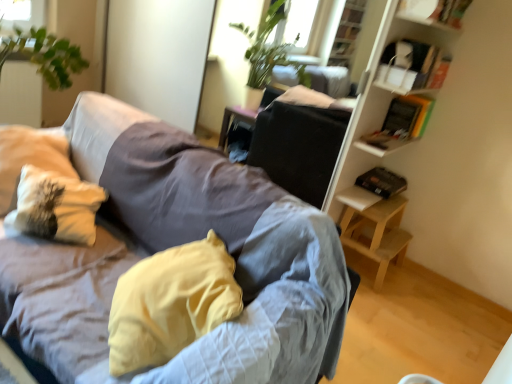
I want to click on wooden bookshelf at right, so click(x=376, y=112).

How much space does white textured pillow at left, marked as the second pillow in a right-to-left arrangement, occupy horizontally?

The width of white textured pillow at left, marked as the second pillow in a right-to-left arrangement, is 10.49 inches.

What do you see at coordinates (170, 303) in the screenshot? I see `yellow fabric pillow at center, which is counted as the first pillow, starting from the right` at bounding box center [170, 303].

The height and width of the screenshot is (384, 512). Describe the element at coordinates (374, 227) in the screenshot. I see `light wood table at lower right` at that location.

What do you see at coordinates (434, 12) in the screenshot?
I see `wooden bookshelf at upper right, which is the first shelf from top to bottom` at bounding box center [434, 12].

This screenshot has width=512, height=384. Describe the element at coordinates (224, 241) in the screenshot. I see `textured gray couch at center` at that location.

Locate an element on the screen. wooden bookshelf at right is located at coordinates (376, 112).

In the image, is light wood table at lower right on the left side or the right side of yellow fabric pillow at center, which is counted as the first pillow, starting from the right?

From the image, it's evident that light wood table at lower right is to the right of yellow fabric pillow at center, which is counted as the first pillow, starting from the right.

Does light wood table at lower right have a larger size compared to yellow fabric pillow at center, which is counted as the first pillow, starting from the right?

No.

Where is `table behind the yellow fabric pillow at center, the 2th pillow when ordered from left to right`? table behind the yellow fabric pillow at center, the 2th pillow when ordered from left to right is located at coordinates (374, 227).

Is light wood table at lower right not inside yellow fabric pillow at center, which is counted as the first pillow, starting from the right?

That's correct, light wood table at lower right is outside of yellow fabric pillow at center, which is counted as the first pillow, starting from the right.

Does wooden bookshelf at upper right, which is the first shelf from top to bottom, contain white textured pillow at left, which is the 1th pillow in left-to-right order?

No, white textured pillow at left, which is the 1th pillow in left-to-right order, is not surrounded by wooden bookshelf at upper right, which is the first shelf from top to bottom.

In the image, is wooden bookshelf at upper right, which is the second shelf in bottom-to-top order, on the left side or the right side of white textured pillow at left, marked as the second pillow in a right-to-left arrangement?

wooden bookshelf at upper right, which is the second shelf in bottom-to-top order, is to the right of white textured pillow at left, marked as the second pillow in a right-to-left arrangement.

Looking at this image, from a real-world perspective, does wooden bookshelf at upper right, which is the second shelf in bottom-to-top order, sit lower than white textured pillow at left, marked as the second pillow in a right-to-left arrangement?

No, from a real-world perspective, wooden bookshelf at upper right, which is the second shelf in bottom-to-top order, is not beneath white textured pillow at left, marked as the second pillow in a right-to-left arrangement.

Identify the location of the 2nd shelf counting from the right of the white textured pillow at left, which is the 1th pillow in left-to-right order. This screenshot has width=512, height=384. (434, 12).

Is wooden bookshelf at right wider or thinner than light wood table at lower right?

Clearly, wooden bookshelf at right has less width compared to light wood table at lower right.

Would you say wooden bookshelf at right is inside or outside light wood table at lower right?

The correct answer is: outside.

From a real-world perspective, is wooden bookshelf at right on top of light wood table at lower right?

Yes, from a real-world perspective, wooden bookshelf at right is on top of light wood table at lower right.

Which of these two, wooden bookshelf at right or light wood table at lower right, stands taller?

Standing taller between the two is wooden bookshelf at right.

Can you tell me how much wooden bookshelf at right and white textured pillow at left, marked as the second pillow in a right-to-left arrangement, differ in facing direction?

The angular difference between wooden bookshelf at right and white textured pillow at left, marked as the second pillow in a right-to-left arrangement, is 49.6 degrees.

Based on the photo, is wooden bookshelf at right looking in the opposite direction of white textured pillow at left, marked as the second pillow in a right-to-left arrangement?

No, wooden bookshelf at right's orientation is not away from white textured pillow at left, marked as the second pillow in a right-to-left arrangement.

From the picture: Is wooden bookshelf at right next to white textured pillow at left, which is the 1th pillow in left-to-right order, and touching it?

No, wooden bookshelf at right is not with white textured pillow at left, which is the 1th pillow in left-to-right order.

Considering the relative sizes of yellow fabric pillow at center, which is counted as the first pillow, starting from the right, and wooden bookshelf at right in the image provided, is yellow fabric pillow at center, which is counted as the first pillow, starting from the right, wider than wooden bookshelf at right?

Correct, the width of yellow fabric pillow at center, which is counted as the first pillow, starting from the right, exceeds that of wooden bookshelf at right.

Is yellow fabric pillow at center, the 2th pillow when ordered from left to right, far from wooden bookshelf at right?

yellow fabric pillow at center, the 2th pillow when ordered from left to right, is positioned a significant distance from wooden bookshelf at right.

From a real-world perspective, which is physically above, yellow fabric pillow at center, which is counted as the first pillow, starting from the right, or wooden bookshelf at right?

wooden bookshelf at right is physically above.

From the image's perspective, which is above, yellow fabric pillow at center, the 2th pillow when ordered from left to right, or wooden bookshelf at right?

wooden bookshelf at right is shown above in the image.

Considering the sizes of wooden bookshelf at upper right, which is the second shelf in bottom-to-top order, and light wood table at lower right in the image, is wooden bookshelf at upper right, which is the second shelf in bottom-to-top order, bigger or smaller than light wood table at lower right?

Clearly, wooden bookshelf at upper right, which is the second shelf in bottom-to-top order, is smaller in size than light wood table at lower right.

Is wooden bookshelf at upper right, which is the first shelf from top to bottom, not close to light wood table at lower right?

wooden bookshelf at upper right, which is the first shelf from top to bottom, is far away from light wood table at lower right.

Based on their positions, is wooden bookshelf at upper right, which is the second shelf in bottom-to-top order, located to the left or right of light wood table at lower right?

wooden bookshelf at upper right, which is the second shelf in bottom-to-top order, is to the right of light wood table at lower right.

Locate an element on the screen. The width and height of the screenshot is (512, 384). the 2nd shelf in front of the light wood table at lower right is located at coordinates (434, 12).

Is there a large distance between light wood table at lower right and wooden bookshelf at upper right, which is the second shelf in bottom-to-top order?

Yes, light wood table at lower right and wooden bookshelf at upper right, which is the second shelf in bottom-to-top order, are located far from each other.

Identify the location of table lying below the wooden bookshelf at upper right, which is the second shelf in bottom-to-top order (from the image's perspective). The height and width of the screenshot is (384, 512). (374, 227).

Considering the sizes of objects light wood table at lower right and wooden bookshelf at upper right, which is the first shelf from top to bottom, in the image provided, who is wider, light wood table at lower right or wooden bookshelf at upper right, which is the first shelf from top to bottom,?

With larger width is light wood table at lower right.

Can you confirm if light wood table at lower right is taller than wooden bookshelf at upper right, which is the second shelf in bottom-to-top order?

Correct, light wood table at lower right is much taller as wooden bookshelf at upper right, which is the second shelf in bottom-to-top order.

The width and height of the screenshot is (512, 384). What are the coordinates of `table behind the yellow fabric pillow at center, which is counted as the first pillow, starting from the right` in the screenshot? It's located at (374, 227).

Image resolution: width=512 pixels, height=384 pixels. Identify the location of the 1st pillow below the wooden bookshelf at upper right, which is the first shelf from top to bottom (from the image's perspective). click(56, 206).

Consider the image. Considering their positions, is wooden bookshelf at upper right, which is the first shelf from top to bottom, positioned closer to white cardboard box at upper right, acting as the first shelf starting from the bottom, than yellow fabric pillow at center, which is counted as the first pillow, starting from the right?

wooden bookshelf at upper right, which is the first shelf from top to bottom, is closer to white cardboard box at upper right, acting as the first shelf starting from the bottom.

Looking at the image, which one is located further to wooden bookshelf at upper right, which is the first shelf from top to bottom, wooden bookshelf at right or light wood table at lower right?

light wood table at lower right lies further to wooden bookshelf at upper right, which is the first shelf from top to bottom, than the other object.

In the scene shown: Based on their spatial positions, is yellow fabric pillow at center, the 2th pillow when ordered from left to right, or light wood table at lower right further from wooden bookshelf at upper right, which is the first shelf from top to bottom?

The object further to wooden bookshelf at upper right, which is the first shelf from top to bottom, is yellow fabric pillow at center, the 2th pillow when ordered from left to right.

When comparing their distances from wooden bookshelf at right, does white textured pillow at left, marked as the second pillow in a right-to-left arrangement, or light wood table at lower right seem closer?

Among the two, light wood table at lower right is located nearer to wooden bookshelf at right.

From the picture: Which object lies nearer to the anchor point white textured pillow at left, which is the 1th pillow in left-to-right order, yellow fabric pillow at center, which is counted as the first pillow, starting from the right, or wooden bookshelf at upper right, which is the first shelf from top to bottom?

yellow fabric pillow at center, which is counted as the first pillow, starting from the right.

When comparing their distances from textured gray couch at center, does yellow fabric pillow at center, the 2th pillow when ordered from left to right, or wooden bookshelf at upper right, which is the first shelf from top to bottom, seem closer?

yellow fabric pillow at center, the 2th pillow when ordered from left to right, is positioned closer to the anchor textured gray couch at center.

Considering their positions, is white cardboard box at upper right, which is counted as the second shelf, starting from the top, positioned further to wooden bookshelf at right than light wood table at lower right?

white cardboard box at upper right, which is counted as the second shelf, starting from the top, is further to wooden bookshelf at right.

When comparing their distances from yellow fabric pillow at center, the 2th pillow when ordered from left to right, does white textured pillow at left, which is the 1th pillow in left-to-right order, or textured gray couch at center seem further?

white textured pillow at left, which is the 1th pillow in left-to-right order, is further to yellow fabric pillow at center, the 2th pillow when ordered from left to right.

At what (x,y) coordinates should I click in order to perform the action: click on bookshelf between wooden bookshelf at upper right, which is the first shelf from top to bottom, and light wood table at lower right from top to bottom. Please return your answer as a coordinate pair (x, y). Looking at the image, I should click on (376, 112).

Where is `bookshelf located between white textured pillow at left, marked as the second pillow in a right-to-left arrangement, and wooden bookshelf at upper right, which is the second shelf in bottom-to-top order, in the left-right direction`? Image resolution: width=512 pixels, height=384 pixels. bookshelf located between white textured pillow at left, marked as the second pillow in a right-to-left arrangement, and wooden bookshelf at upper right, which is the second shelf in bottom-to-top order, in the left-right direction is located at coordinates (376, 112).

This screenshot has height=384, width=512. In order to click on shelf situated between white textured pillow at left, marked as the second pillow in a right-to-left arrangement, and wooden bookshelf at upper right, which is the first shelf from top to bottom, from left to right in this screenshot , I will do `click(412, 66)`.

You are a GUI agent. You are given a task and a screenshot of the screen. Output one action in this format:
    pyautogui.click(x=<x>, y=<y>)
    Task: Click on the table between white textured pillow at left, which is the 1th pillow in left-to-right order, and white cardboard box at upper right, which is counted as the second shelf, starting from the top, from left to right
    This screenshot has height=384, width=512.
    Given the screenshot: What is the action you would take?
    pyautogui.click(x=374, y=227)